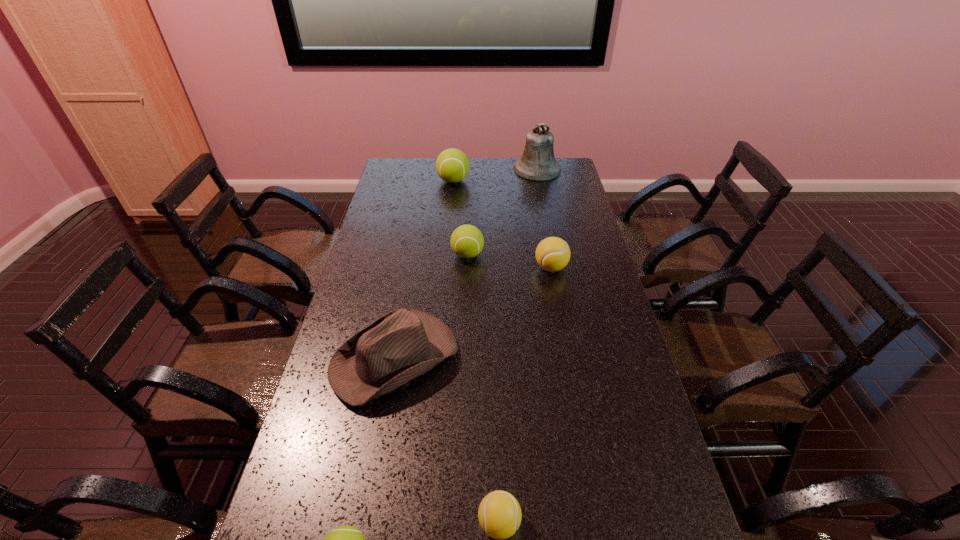
In the image, there is a desktop. Where is `blank space at the right edge`? blank space at the right edge is located at coordinates (588, 305).

Image resolution: width=960 pixels, height=540 pixels. What are the coordinates of `vacant area at the far left corner of the desktop` in the screenshot? It's located at (389, 171).

Where is `vacant area that lies between the farther yellow tennis ball and the biggest green tennis ball`? vacant area that lies between the farther yellow tennis ball and the biggest green tennis ball is located at coordinates (502, 224).

Where is `free spot between the bigger yellow tennis ball and the second farthest green tennis ball`? The height and width of the screenshot is (540, 960). free spot between the bigger yellow tennis ball and the second farthest green tennis ball is located at coordinates (509, 261).

You are a GUI agent. You are given a task and a screenshot of the screen. Output one action in this format:
    pyautogui.click(x=<x>, y=<y>)
    Task: Click on the vacant region between the farthest green tennis ball and the right yellow tennis ball
    
    Given the screenshot: What is the action you would take?
    pyautogui.click(x=502, y=224)

You are a GUI agent. You are given a task and a screenshot of the screen. Output one action in this format:
    pyautogui.click(x=<x>, y=<y>)
    Task: Click on the free area in between the tallest tennis ball and the third nearest object
    
    Given the screenshot: What is the action you would take?
    pyautogui.click(x=424, y=270)

Locate an element on the screen. This screenshot has height=540, width=960. free space between the fifth farthest object and the biggest green tennis ball is located at coordinates pyautogui.click(x=424, y=270).

Locate an element on the screen. The width and height of the screenshot is (960, 540). vacant space that is in between the fifth farthest object and the biggest green tennis ball is located at coordinates (424, 270).

Identify which object is located as the fifth nearest to the farthest tennis ball. Please provide its 2D coordinates. Your answer should be formatted as a tuple, i.e. [(x, y)], where the tuple contains the x and y coordinates of a point satisfying the conditions above.

[(499, 514)]

Where is `object that is the second closest to the farthest tennis ball`? This screenshot has width=960, height=540. object that is the second closest to the farthest tennis ball is located at coordinates (467, 241).